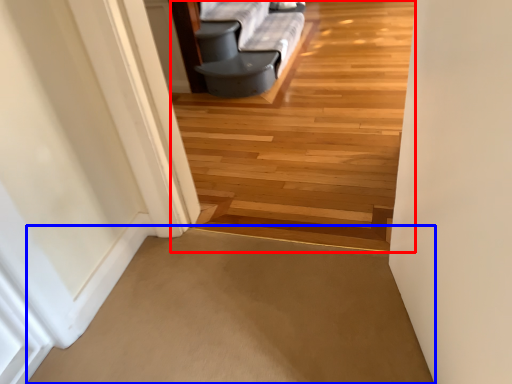
Question: Which point is further to the camera, path (highlighted by a red box) or path (highlighted by a blue box)?

Choices:
 (A) path
 (B) path

Answer: (B)